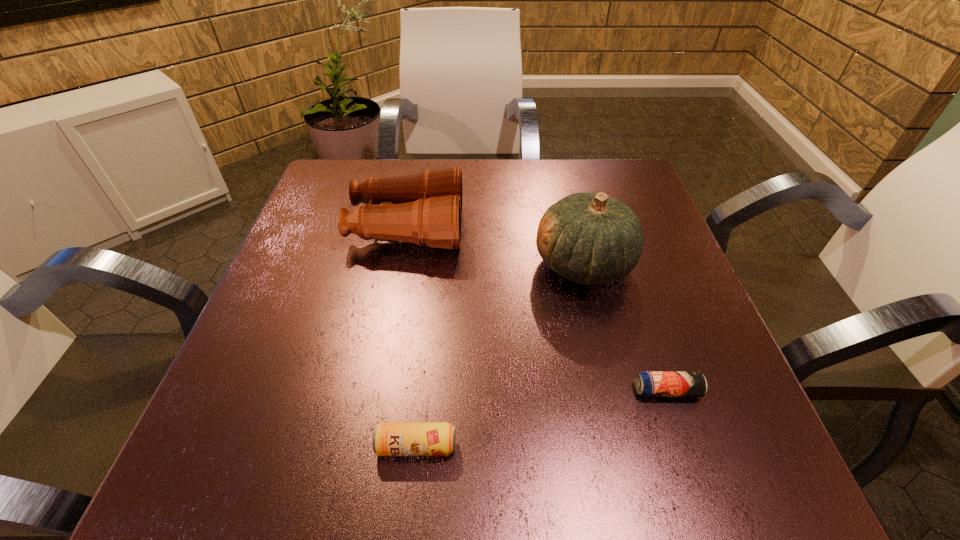
The image size is (960, 540). Find the location of `free space between the nearer beer can and the farther beer can`. free space between the nearer beer can and the farther beer can is located at coordinates point(541,418).

At what (x,y) coordinates should I click in order to perform the action: click on vacant region between the second tallest object and the left beer can. Please return your answer as a coordinate pair (x, y). Image resolution: width=960 pixels, height=540 pixels. Looking at the image, I should click on (412, 337).

At what (x,y) coordinates should I click in order to perform the action: click on empty location between the third farthest object and the tallest object. Please return your answer as a coordinate pair (x, y). Looking at the image, I should click on click(625, 328).

The height and width of the screenshot is (540, 960). I want to click on object that is the closest to the second nearest object, so click(592, 239).

Choose which object is the third nearest neighbor to the binoculars. Please provide its 2D coordinates. Your answer should be formatted as a tuple, i.e. [(x, y)], where the tuple contains the x and y coordinates of a point satisfying the conditions above.

[(648, 383)]

Find the location of `vacant space that satisfies the following two spatial constraints: 1. on the back side of the left beer can; 2. on the right side of the gourd`. vacant space that satisfies the following two spatial constraints: 1. on the back side of the left beer can; 2. on the right side of the gourd is located at coordinates (436, 265).

At what (x,y) coordinates should I click in order to perform the action: click on vacant position in the image that satisfies the following two spatial constraints: 1. through the lenses of the third shortest object; 2. on the back side of the nearest object. Please return your answer as a coordinate pair (x, y). The image size is (960, 540). Looking at the image, I should click on (367, 446).

Find the location of a particular element. This screenshot has height=540, width=960. free location that satisfies the following two spatial constraints: 1. through the lenses of the binoculars; 2. on the left side of the tallest object is located at coordinates (400, 265).

I want to click on vacant area in the image that satisfies the following two spatial constraints: 1. through the lenses of the binoculars; 2. on the left side of the tallest object, so click(400, 265).

Locate an element on the screen. free location that satisfies the following two spatial constraints: 1. through the lenses of the binoculars; 2. on the right side of the nearer beer can is located at coordinates (367, 446).